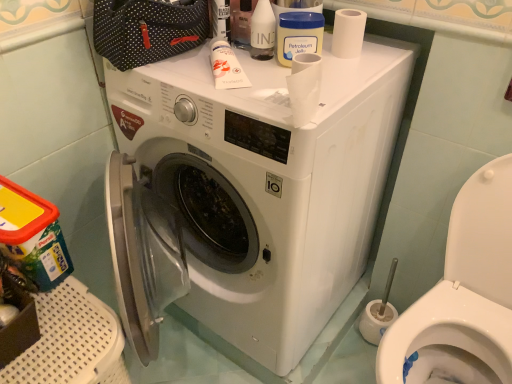
I want to click on free space to the left of white matte tube at upper center, the 1th toiletry ordered from the bottom, so click(x=175, y=71).